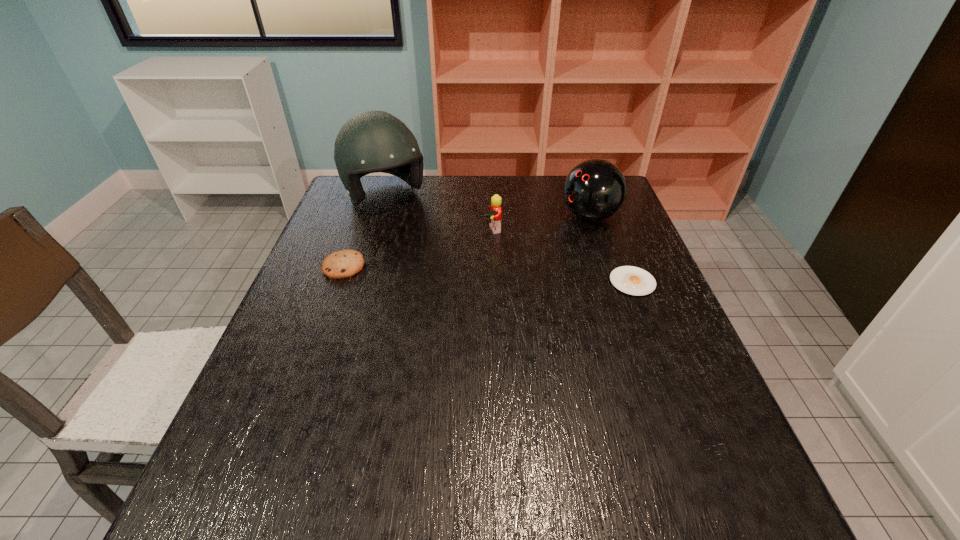
This screenshot has height=540, width=960. What are the coordinates of `the fourth tallest object` in the screenshot? It's located at (341, 264).

Locate an element on the screen. The image size is (960, 540). the shortest object is located at coordinates (631, 280).

Where is `the tallest object`? the tallest object is located at coordinates (372, 141).

Where is `the third tallest object`? The width and height of the screenshot is (960, 540). the third tallest object is located at coordinates (494, 214).

At what (x,y) coordinates should I click in order to perform the action: click on Lego. Please return your answer as a coordinate pair (x, y). This screenshot has height=540, width=960. Looking at the image, I should click on (494, 214).

Locate an element on the screen. The height and width of the screenshot is (540, 960). bowling ball is located at coordinates (595, 189).

The height and width of the screenshot is (540, 960). Identify the location of vacant space located on the front of the fourth tallest object. (313, 351).

I want to click on vacant space located on the front of the egg yolk, so click(x=701, y=457).

Find the location of a particular element. This screenshot has height=540, width=960. vacant space situated 0.140m at the face opening of the tallest object is located at coordinates (420, 242).

Locate an element on the screen. The image size is (960, 540). vacant region located at the face opening of the tallest object is located at coordinates (446, 274).